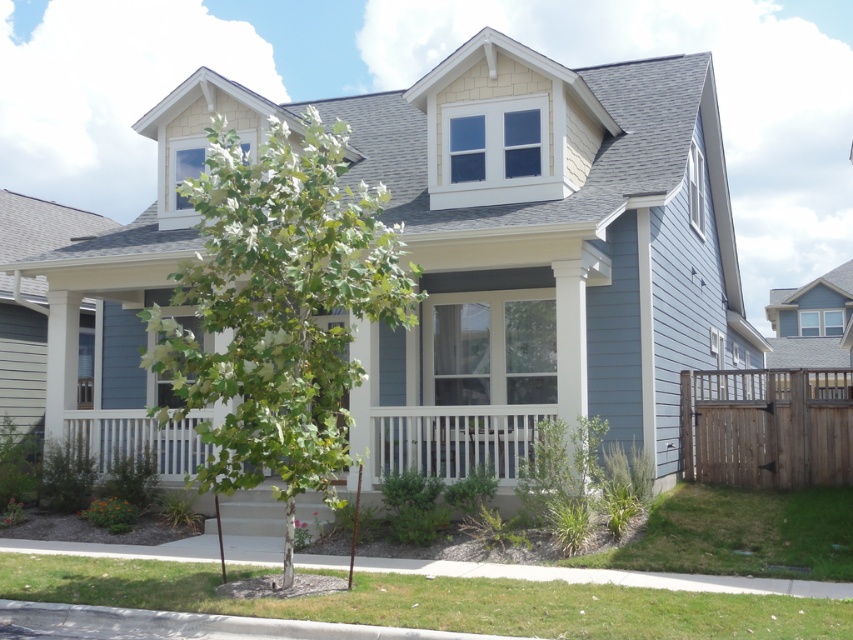
Which is above, green leafy tree at center or brown wooden fence at right?

Positioned higher is green leafy tree at center.

How far apart are green leafy tree at center and brown wooden fence at right?

green leafy tree at center is 7.65 meters away from brown wooden fence at right.

Where is `green leafy tree at center`? green leafy tree at center is located at coordinates (277, 310).